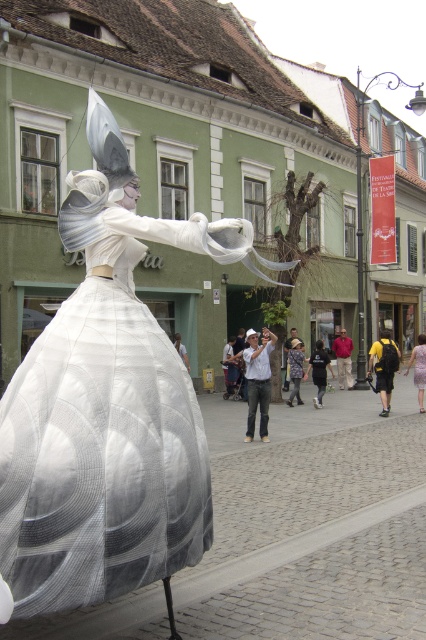
Question: Estimate the real-world distances between objects in this image. Which object is closer to the matte white dress at center?

Choices:
 (A) floral-patterned dress at center
 (B) black cotton t-shirt at center
 (C) white fabric street artist at center
 (D) white sheer dress at center

Answer: (B)

Question: Can you confirm if black cotton t-shirt at center is positioned below matte white dress at center?

Choices:
 (A) no
 (B) yes

Answer: (A)

Question: Which of the following is the closest to the observer?

Choices:
 (A) floral-patterned dress at center
 (B) white sheer dress at center

Answer: (B)

Question: Can you confirm if black cotton t-shirt at center is positioned above matte white dress at center?

Choices:
 (A) no
 (B) yes

Answer: (B)

Question: Which object is farther from the camera taking this photo?

Choices:
 (A) matte white dress at center
 (B) floral-patterned dress at center

Answer: (B)

Question: From the image, what is the correct spatial relationship of black cotton t-shirt at center in relation to matte white dress at center?

Choices:
 (A) right
 (B) left

Answer: (B)